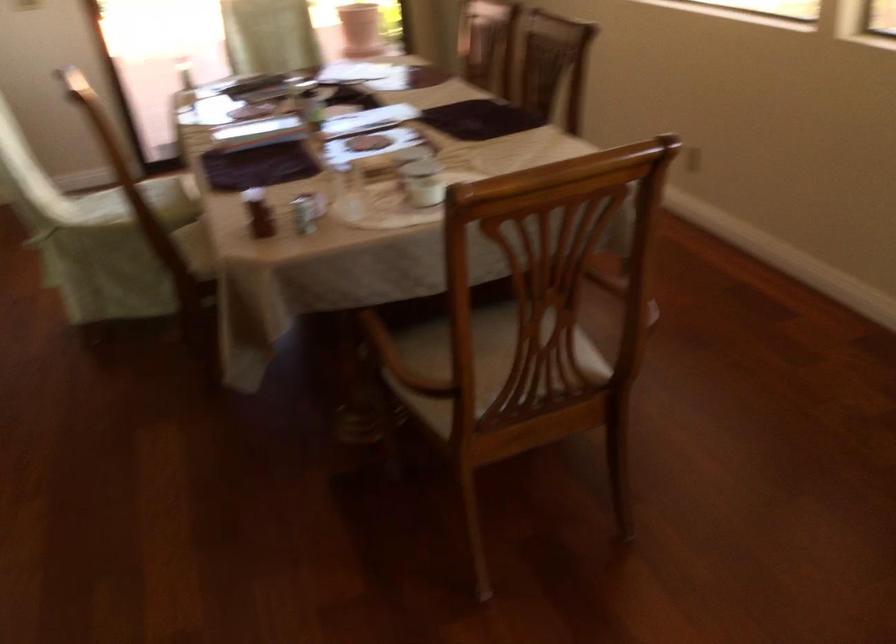
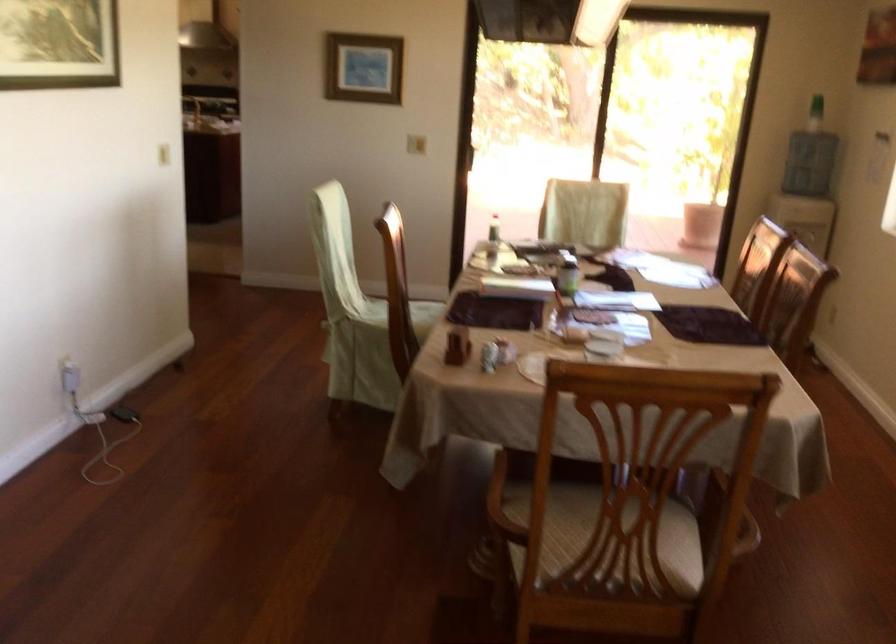
Find the pixel in the second image that matches point 503,328 in the first image.

(631, 513)